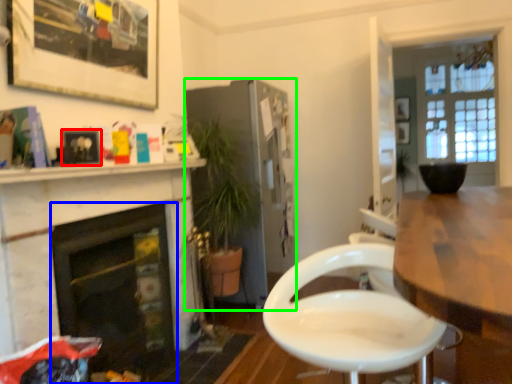
Question: Estimate the real-world distances between objects in this image. Which object is closer to picture frame (highlighted by a red box), fireplace (highlighted by a blue box) or cabinetry (highlighted by a green box)?

Choices:
 (A) fireplace
 (B) cabinetry

Answer: (A)